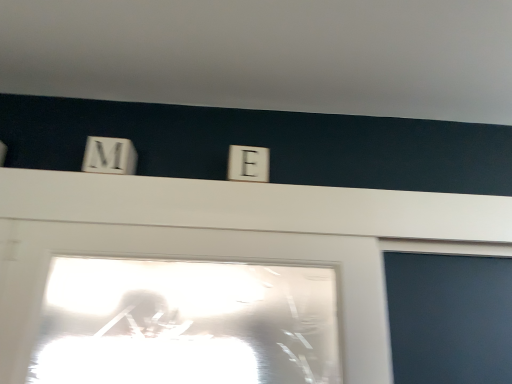
This screenshot has height=384, width=512. In order to click on white plastic letter e at center in this screenshot , I will do `click(248, 163)`.

The width and height of the screenshot is (512, 384). What do you see at coordinates (248, 163) in the screenshot? I see `white plastic letter e at center` at bounding box center [248, 163].

Find the location of `white wooden letter m at upper left`. white wooden letter m at upper left is located at coordinates (109, 156).

Describe the element at coordinates (109, 156) in the screenshot. I see `white wooden letter m at upper left` at that location.

Measure the distance between white wooden letter m at upper left and camera.

1.06 meters.

The height and width of the screenshot is (384, 512). Find the location of `white plastic letter e at center`. white plastic letter e at center is located at coordinates (248, 163).

Based on their positions, is white wooden letter m at upper left located to the left or right of white plastic letter e at center?

Clearly, white wooden letter m at upper left is on the left of white plastic letter e at center in the image.

In the image, is white wooden letter m at upper left positioned in front of or behind white plastic letter e at center?

white wooden letter m at upper left is in front of white plastic letter e at center.

Does point (126, 144) come closer to viewer compared to point (246, 178)?

No, (126, 144) is behind (246, 178).

From the image's perspective, between white wooden letter m at upper left and white plastic letter e at center, which one is located above?

white wooden letter m at upper left appears higher in the image.

From a real-world perspective, is white wooden letter m at upper left positioned under white plastic letter e at center based on gravity?

No, from a real-world perspective, white wooden letter m at upper left is not below white plastic letter e at center.

Is white wooden letter m at upper left wider than white plastic letter e at center?

Incorrect, the width of white wooden letter m at upper left does not surpass that of white plastic letter e at center.

Does white wooden letter m at upper left have a lesser height compared to white plastic letter e at center?

In fact, white wooden letter m at upper left may be taller than white plastic letter e at center.

Is white wooden letter m at upper left bigger or smaller than white plastic letter e at center?

Clearly, white wooden letter m at upper left is smaller in size than white plastic letter e at center.

Which is correct: white wooden letter m at upper left is inside white plastic letter e at center, or outside of it?

white wooden letter m at upper left is outside white plastic letter e at center.

Are white wooden letter m at upper left and white plastic letter e at center making contact?

They are not placed beside each other.

Could you tell me if white wooden letter m at upper left is turned towards white plastic letter e at center?

No, white wooden letter m at upper left does not turn towards white plastic letter e at center.

Can you tell me how much white wooden letter m at upper left and white plastic letter e at center differ in facing direction?

3.19 degrees separate the facing orientations of white wooden letter m at upper left and white plastic letter e at center.

How distant is white wooden letter m at upper left from white plastic letter e at center?

white wooden letter m at upper left is 12.12 inches away from white plastic letter e at center.

Where is `electric outlet below the white wooden letter m at upper left (from the image's perspective)`? electric outlet below the white wooden letter m at upper left (from the image's perspective) is located at coordinates (248, 163).

Which is more to the left, white plastic letter e at center or white wooden letter m at upper left?

From the viewer's perspective, white wooden letter m at upper left appears more on the left side.

Which object is further away from the camera taking this photo, white plastic letter e at center or white wooden letter m at upper left?

Positioned behind is white plastic letter e at center.

Which point is more distant from viewer, (243, 166) or (119, 162)?

Point (243, 166)

From the picture: From the image's perspective, who appears lower, white plastic letter e at center or white wooden letter m at upper left?

white plastic letter e at center, from the image's perspective.

From a real-world perspective, which is physically below, white plastic letter e at center or white wooden letter m at upper left?

white plastic letter e at center, from a real-world perspective.

Which object is thinner, white plastic letter e at center or white wooden letter m at upper left?

Thinner between the two is white wooden letter m at upper left.

Which of these two, white plastic letter e at center or white wooden letter m at upper left, stands shorter?

With less height is white plastic letter e at center.

In the scene shown: Considering the sizes of objects white plastic letter e at center and white wooden letter m at upper left in the image provided, who is smaller, white plastic letter e at center or white wooden letter m at upper left?

With smaller size is white wooden letter m at upper left.

Could white wooden letter m at upper left be considered to be inside white plastic letter e at center?

No, white wooden letter m at upper left is located outside of white plastic letter e at center.

Would you consider white plastic letter e at center to be distant from white wooden letter m at upper left?

No, white plastic letter e at center is not far from white wooden letter m at upper left.

Is white plastic letter e at center aimed at white wooden letter m at upper left?

No, white plastic letter e at center is not turned towards white wooden letter m at upper left.

This screenshot has width=512, height=384. Identify the location of electric outlet on the right of white wooden letter m at upper left. (248, 163).

At what (x,y) coordinates should I click in order to perform the action: click on light switch located on the left of white plastic letter e at center. Please return your answer as a coordinate pair (x, y). This screenshot has height=384, width=512. Looking at the image, I should click on (109, 156).

Where is `electric outlet behind the white wooden letter m at upper left`? This screenshot has width=512, height=384. electric outlet behind the white wooden letter m at upper left is located at coordinates (248, 163).